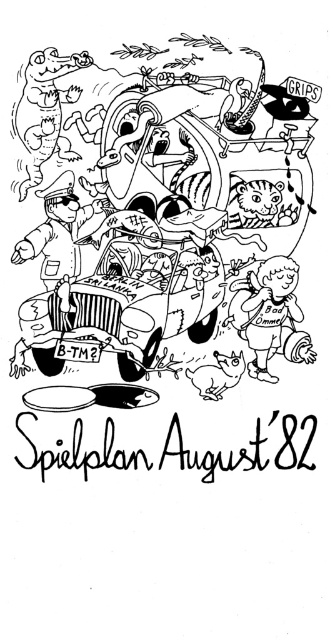
From the picture: Looking at the black rubber car at center and the black matte car at center in the illustration, which one is positioned to the right?

The black rubber car at center is positioned to the right of the black matte car at center.